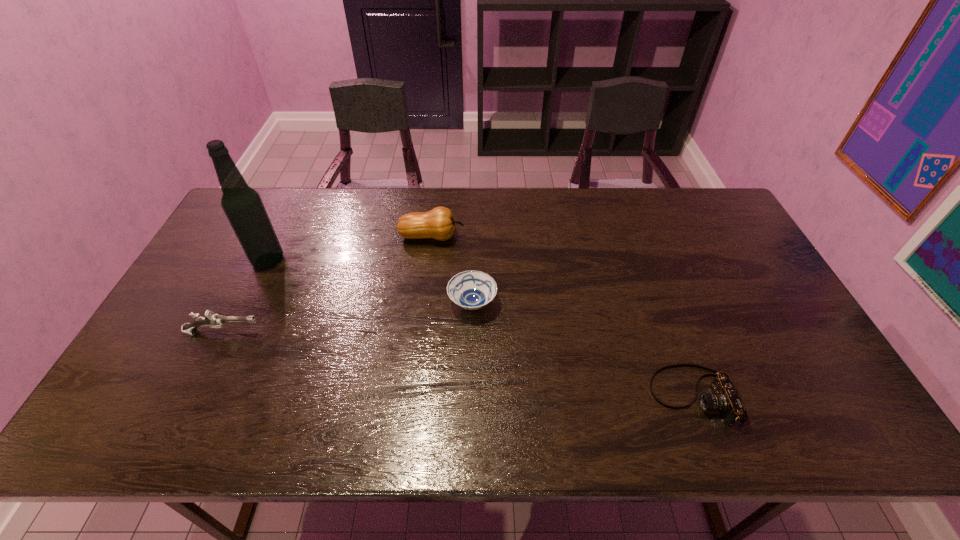
At what (x,y) coordinates should I click in order to perform the action: click on vacant space at the far edge of the desktop. Please return your answer as a coordinate pair (x, y). This screenshot has width=960, height=540. Looking at the image, I should click on (500, 205).

This screenshot has height=540, width=960. In order to click on vacant space at the near edge in this screenshot , I will do `click(748, 417)`.

Locate an element on the screen. This screenshot has height=540, width=960. vacant space at the left edge of the desktop is located at coordinates (227, 262).

Where is `vacant space at the right edge`? The height and width of the screenshot is (540, 960). vacant space at the right edge is located at coordinates (734, 290).

I want to click on vacant region at the far right corner, so [x=717, y=227].

Find the location of a particular element. This screenshot has height=540, width=960. vacant point located between the third nearest object and the farthest object is located at coordinates (452, 270).

You are a GUI agent. You are given a task and a screenshot of the screen. Output one action in this format:
    pyautogui.click(x=<x>, y=<y>)
    Task: Click on the unoccupied area between the third nearest object and the gourd
    
    Given the screenshot: What is the action you would take?
    pos(452,270)

I want to click on free area in between the fourth nearest object and the third nearest object, so click(x=371, y=281).

Image resolution: width=960 pixels, height=540 pixels. I want to click on free space between the gun and the fourth shortest object, so click(327, 285).

Where is `free spot between the soup bowl and the gourd`? Image resolution: width=960 pixels, height=540 pixels. free spot between the soup bowl and the gourd is located at coordinates (452, 270).